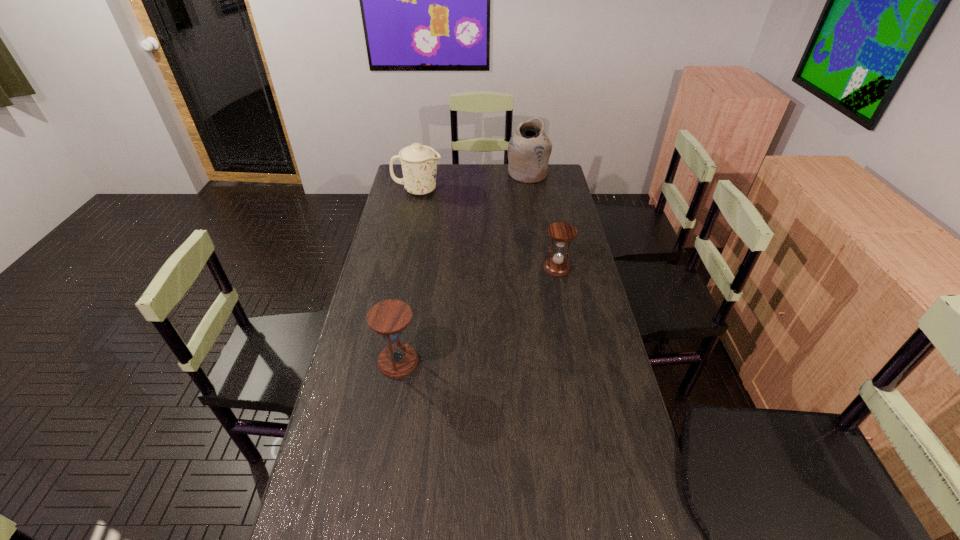
This screenshot has height=540, width=960. What are the coordinates of `pottery that is at the far edge` in the screenshot? It's located at (529, 149).

The height and width of the screenshot is (540, 960). What are the coordinates of `chinaware located at the far edge` in the screenshot? It's located at (419, 162).

Locate an element on the screen. chinaware at the left edge is located at coordinates (419, 162).

Where is `hourglass that is at the left edge`? This screenshot has width=960, height=540. hourglass that is at the left edge is located at coordinates (389, 318).

Where is `pottery that is at the right edge`? The image size is (960, 540). pottery that is at the right edge is located at coordinates (529, 149).

I want to click on hourglass at the right edge, so click(x=557, y=266).

Where is `object that is at the far left corner`? object that is at the far left corner is located at coordinates (419, 162).

You are a GUI agent. You are given a task and a screenshot of the screen. Output one action in this format:
    pyautogui.click(x=<x>, y=<y>)
    Task: Click on the object positioned at the far right corner
    The width and height of the screenshot is (960, 540).
    Given the screenshot: What is the action you would take?
    pyautogui.click(x=529, y=149)

In the image, there is a desktop. Identify the location of free space at the far edge. (467, 175).

In the image, there is a desktop. At what (x,y) coordinates should I click in order to perform the action: click on vacant space at the left edge. Please return your answer as a coordinate pair (x, y). Looking at the image, I should click on (375, 263).